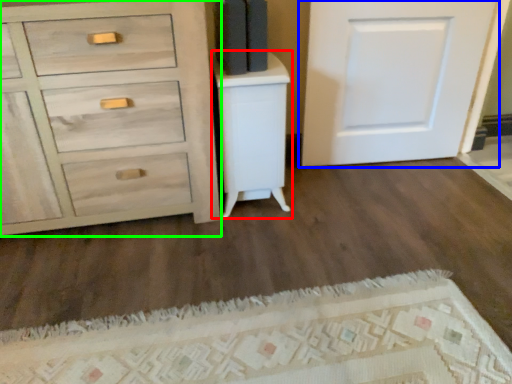
Question: Which object is positioned farthest from vanity (highlighted by a red box)? Select from door (highlighted by a blue box) and chest of drawers (highlighted by a green box).

Choices:
 (A) door
 (B) chest of drawers

Answer: (A)